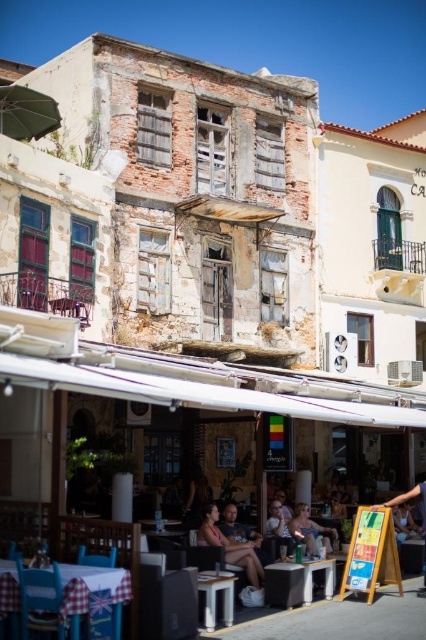
You are a street vendor setting up stalls in the Mediterranean town. You have two tables, the checkered fabric table at lower left and the matte black table at center. Which table is narrower?

The checkered fabric table at lower left has a lesser width compared to the matte black table at center, so the checkered fabric table at lower left is narrower.

You are a photographer standing in the middle of the street, aiming to capture both the matte black table at center and the matte pink tank top at center in your shot. Which object should you adjust your camera to focus on first if you want to include both in the frame without moving?

The matte black table at center is positioned on the left side of the matte pink tank top at center, so you should focus on the matte black table at center first to ensure both are included in the frame.